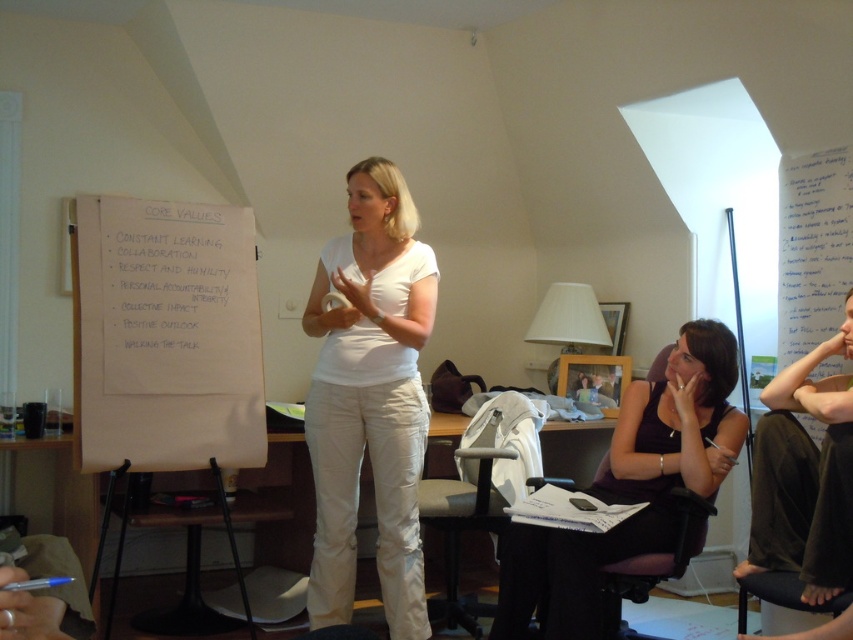
Is white paper at left thinner than dark purple fabric dress at lower right?

No, white paper at left is not thinner than dark purple fabric dress at lower right.

Between point (80, 218) and point (807, 492), which one is positioned behind?

The point (80, 218) is behind.

Which is behind, point (244, 337) or point (840, 433)?

Point (244, 337)

Locate an element on the screen. white paper at left is located at coordinates (165, 337).

Is point (148, 298) behind point (395, 572)?

Yes.

Identify the location of white paper at left. This screenshot has height=640, width=853. (x=165, y=337).

You are a GUI agent. You are given a task and a screenshot of the screen. Output one action in this format:
    pyautogui.click(x=<x>, y=<y>)
    Task: Click on the white paper at left
    This screenshot has width=853, height=640.
    Given the screenshot: What is the action you would take?
    pyautogui.click(x=165, y=337)

Is white cotton shirt at center taller than matte purple dress at lower right?

Indeed, white cotton shirt at center has a greater height compared to matte purple dress at lower right.

Can you confirm if white cotton shirt at center is shorter than matte purple dress at lower right?

No.

Which is behind, point (374, 477) or point (730, 435)?

The point (374, 477) is behind.

What are the coordinates of `white cotton shirt at center` in the screenshot? It's located at (370, 400).